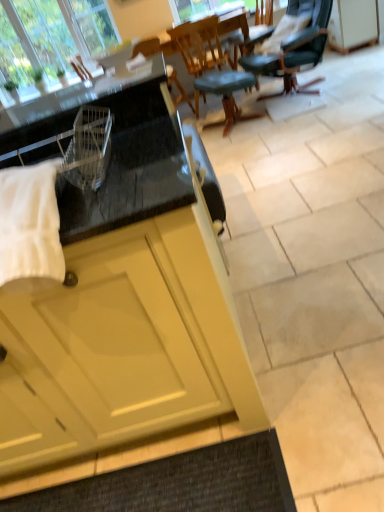
Question: Considering the positions of teal leather stool at center and green leather office chair at upper right, positioned as the first chair in right-to-left order, in the image, is teal leather stool at center taller or shorter than green leather office chair at upper right, positioned as the first chair in right-to-left order,?

Choices:
 (A) short
 (B) tall

Answer: (A)

Question: Is teal leather stool at center in front of or behind green leather office chair at upper right, the second chair when ordered from left to right, in the image?

Choices:
 (A) front
 (B) behind

Answer: (B)

Question: Which object is positioned closest to the green leather office chair at upper right, the second chair when ordered from left to right?

Choices:
 (A) teal leather stool at center
 (B) matte yellow cabinet at upper right, arranged as the second cabinetry when viewed from the left
 (C) wooden chair at center, which appears as the second chair when viewed from the right
 (D) dark gray textured mat at lower center
 (E) clear glass window at upper left

Answer: (A)

Question: Which object is positioned closest to the teal leather stool at center?

Choices:
 (A) green leather office chair at upper right, the second chair when ordered from left to right
 (B) matte yellow cabinet at upper right, which is counted as the first cabinetry, starting from the back
 (C) matte yellow cabinet at lower left, marked as the second cabinetry in a right-to-left arrangement
 (D) dark gray textured mat at lower center
 (E) wooden chair at center, which appears as the first chair when viewed from the left

Answer: (E)